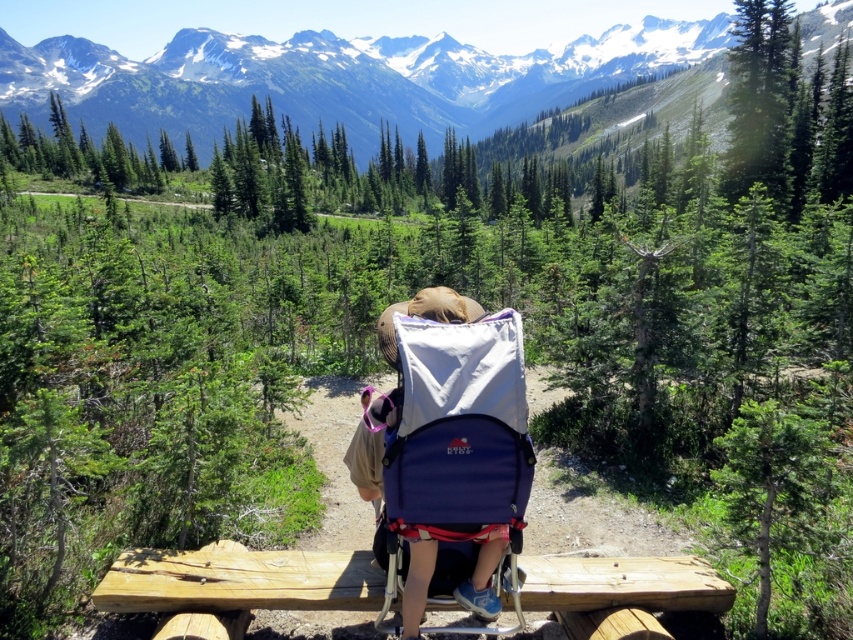
Question: Is snowy granite mountains at upper center thinner than blue fabric baby carriage at center?

Choices:
 (A) yes
 (B) no

Answer: (B)

Question: Which point appears farthest from the camera in this image?

Choices:
 (A) (433, 355)
 (B) (659, 72)

Answer: (B)

Question: Which object is closer to the camera taking this photo?

Choices:
 (A) snowy granite mountains at upper center
 (B) blue fabric baby carriage at center

Answer: (B)

Question: Can you confirm if snowy granite mountains at upper center is wider than blue fabric baby carriage at center?

Choices:
 (A) no
 (B) yes

Answer: (B)

Question: Which of the following is the farthest from the observer?

Choices:
 (A) blue fabric baby carriage at center
 (B) snowy granite mountains at upper center

Answer: (B)

Question: Can you confirm if snowy granite mountains at upper center is positioned to the right of blue fabric baby carriage at center?

Choices:
 (A) yes
 (B) no

Answer: (A)